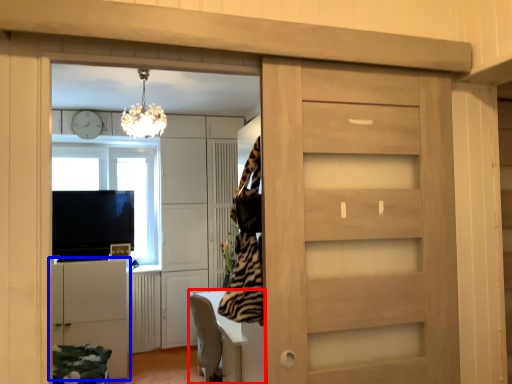
Question: Among these objects, which one is farthest to the camera, table (highlighted by a red box) or cabinetry (highlighted by a blue box)?

Choices:
 (A) table
 (B) cabinetry

Answer: (B)